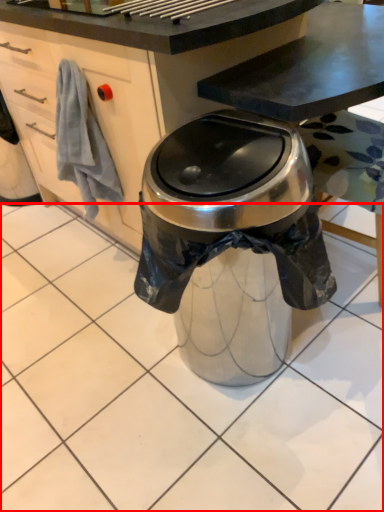
Question: From the image's perspective, what is the correct spatial positioning of tile (annotated by the red box) in reference to cabinetry?

Choices:
 (A) above
 (B) below

Answer: (B)